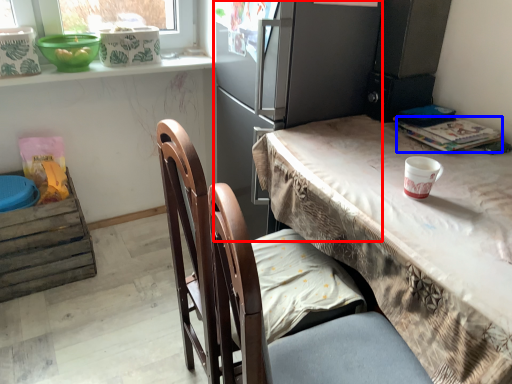
Question: Which object appears farthest to the camera in this image, fridge (highlighted by a red box) or magazine (highlighted by a blue box)?

Choices:
 (A) fridge
 (B) magazine

Answer: (B)